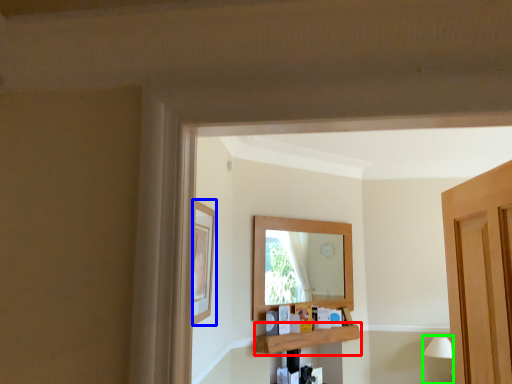
Question: Considering the real-world distances, which object is farthest from shelf (highlighted by a red box)? picture frame (highlighted by a blue box) or lamp (highlighted by a green box)?

Choices:
 (A) picture frame
 (B) lamp

Answer: (A)